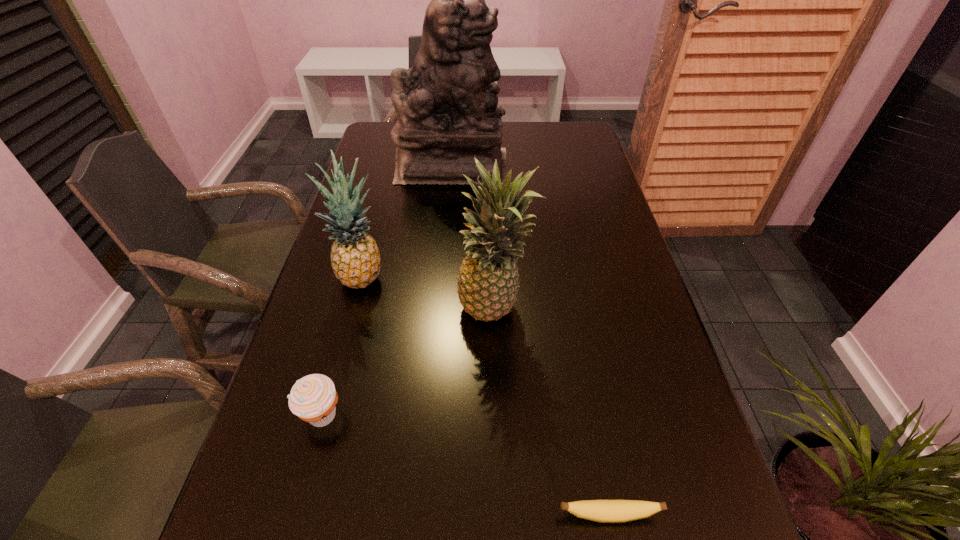
This screenshot has width=960, height=540. Identify the location of the farthest object. (447, 110).

At what (x,y) coordinates should I click in order to perform the action: click on the tallest object. Please return your answer as a coordinate pair (x, y). Looking at the image, I should click on (447, 110).

Where is `the right pineapple`? This screenshot has width=960, height=540. the right pineapple is located at coordinates (487, 283).

Find the location of `the left pineapple`. the left pineapple is located at coordinates (355, 258).

Where is `the fourth farthest object`? the fourth farthest object is located at coordinates (313, 398).

The height and width of the screenshot is (540, 960). Identify the location of the second shortest object. (313, 398).

The width and height of the screenshot is (960, 540). Find the location of `the nearest object`. the nearest object is located at coordinates (604, 511).

Identify the location of the shortest object. [x=604, y=511].

You are a GUI agent. You are given a task and a screenshot of the screen. Output one action in this format:
    pyautogui.click(x=<x>, y=<y>)
    Task: Click on the vacant space located 0.170m on the front-facing side of the sculpture
    This screenshot has height=540, width=960.
    Given the screenshot: What is the action you would take?
    pyautogui.click(x=560, y=165)

This screenshot has width=960, height=540. Identify the location of vacant space situated 0.050m on the front of the right pineapple. (496, 360).